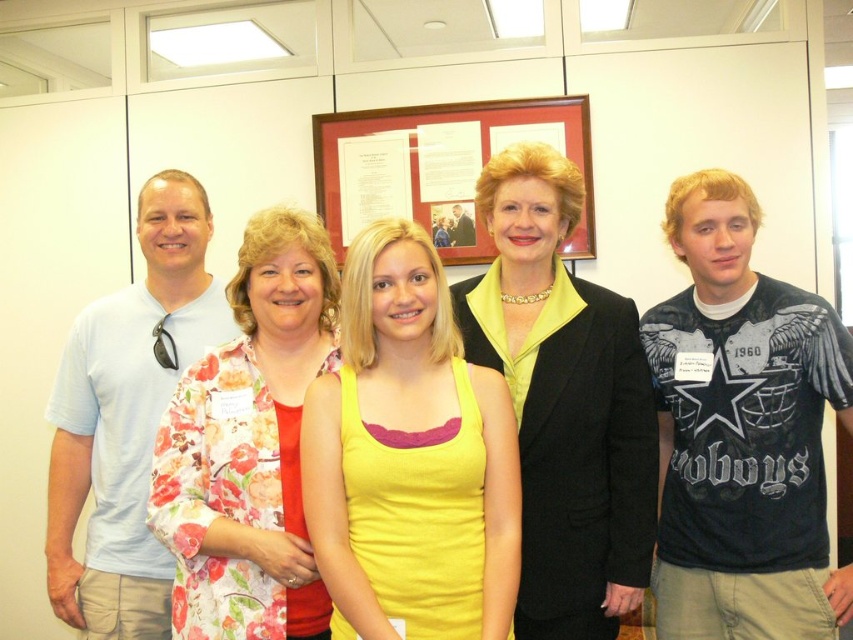
Question: Is wooden framed document at upper center smaller than matte black t-shirt at center?

Choices:
 (A) no
 (B) yes

Answer: (A)

Question: Where is black textured blazer at center located in relation to matte black t-shirt at center in the image?

Choices:
 (A) left
 (B) right

Answer: (B)

Question: Which point appears closest to the camera in this image?

Choices:
 (A) (360, 216)
 (B) (492, 184)
 (C) (490, 381)

Answer: (C)

Question: Does wooden framed document at upper center appear on the right side of matte black t-shirt at center?

Choices:
 (A) yes
 (B) no

Answer: (B)

Question: Estimate the real-world distances between objects in this image. Which object is closer to the white paper at upper center?

Choices:
 (A) matte black t-shirt at center
 (B) black textured blazer at center
 (C) wooden framed document at upper center
 (D) black cotton t-shirt at right

Answer: (C)

Question: Among these objects, which one is farthest from the camera?

Choices:
 (A) floral fabric blouse at center
 (B) wooden framed document at upper center
 (C) yellow fabric tank top at center
 (D) white paper at center

Answer: (D)